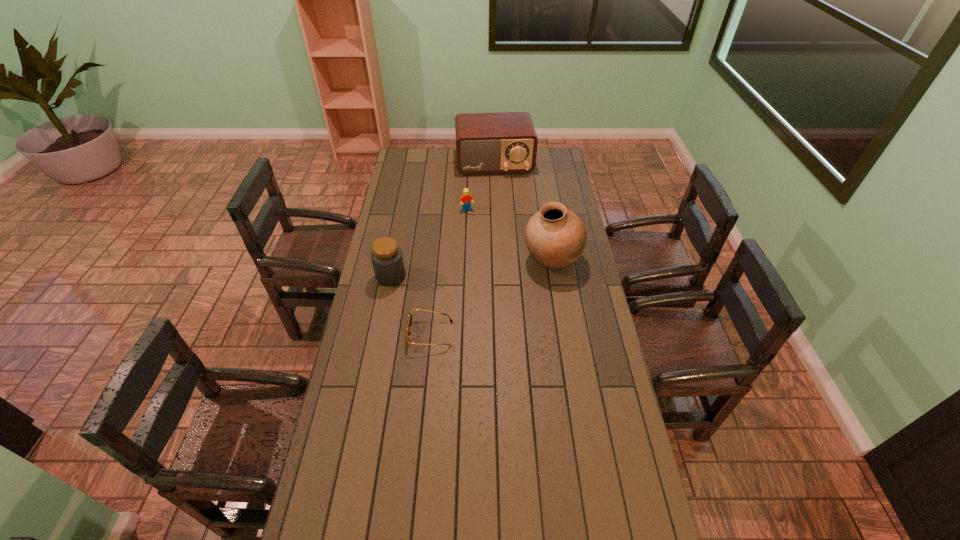
Where is `vacant space on the desktop that is between the shortest object and the pottery and is positioned on the surface of the third tallest object near the warning symbol`? vacant space on the desktop that is between the shortest object and the pottery and is positioned on the surface of the third tallest object near the warning symbol is located at coordinates (485, 300).

What are the coordinates of `vacant space on the desktop that is between the nearest object and the tallest object and is positioned on the face of the second farthest object` in the screenshot? It's located at (503, 289).

Where is `free spot on the desktop that is between the sunglasses and the tallest object and is positioned on the front panel of the radio receiver`? free spot on the desktop that is between the sunglasses and the tallest object and is positioned on the front panel of the radio receiver is located at coordinates (513, 284).